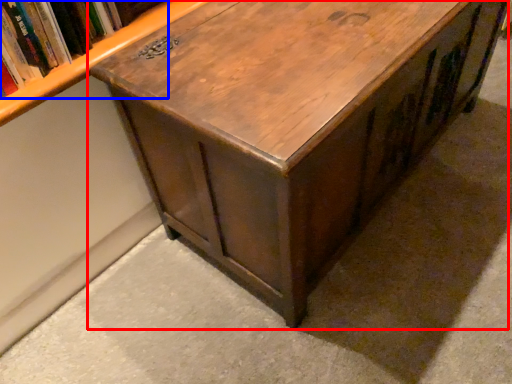
Question: Which point is further to the camera, table (highlighted by a red box) or book (highlighted by a blue box)?

Choices:
 (A) table
 (B) book

Answer: (B)